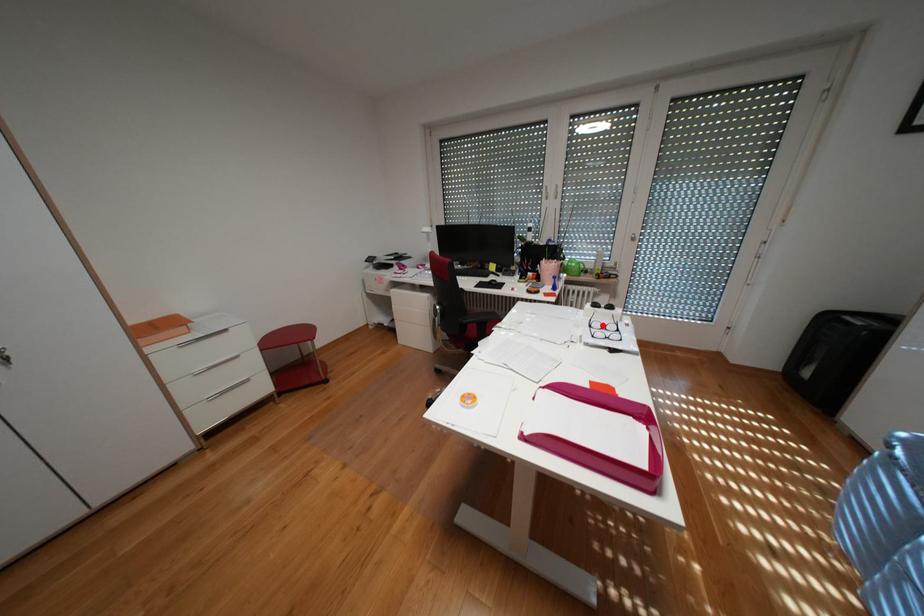
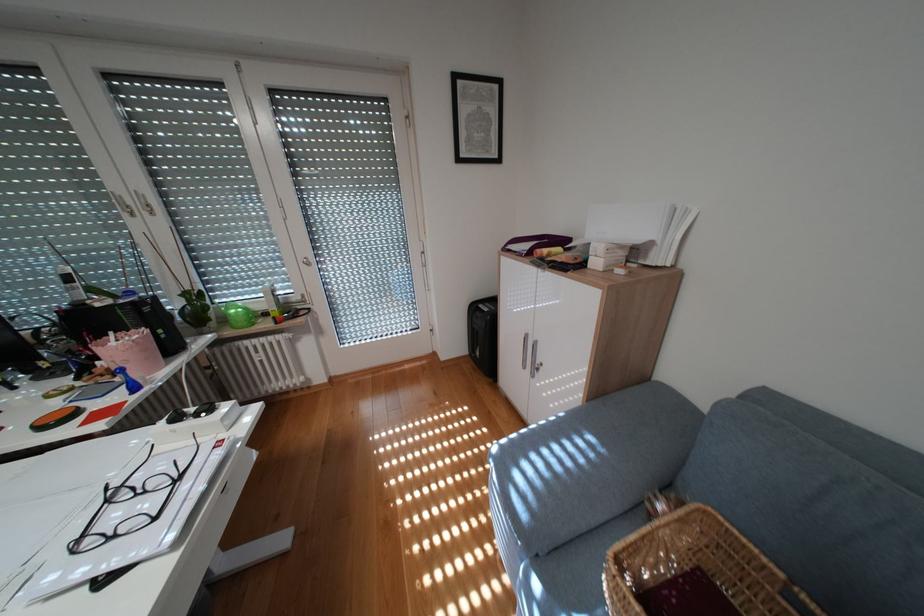
The point at the highlighted location is marked in the first image. Where is the corresponding point in the second image?

(119, 501)